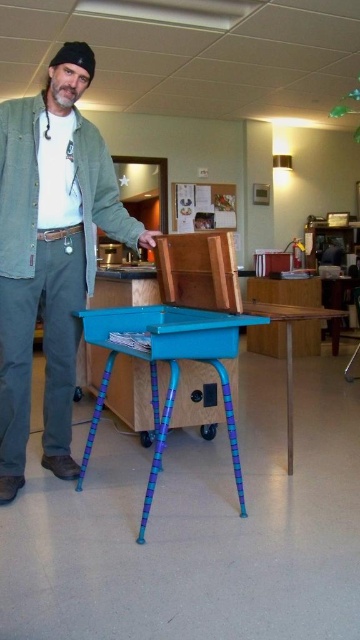
Does matte green jacket at center lie behind teal plastic table at center?

Yes, matte green jacket at center is further from the viewer.

Is point (68, 273) positioned in front of point (259, 316)?

No, (68, 273) is behind (259, 316).

The width and height of the screenshot is (360, 640). What do you see at coordinates (50, 253) in the screenshot?
I see `matte green jacket at center` at bounding box center [50, 253].

Locate an element on the screen. The width and height of the screenshot is (360, 640). matte green jacket at center is located at coordinates (50, 253).

Locate an element on the screen. The image size is (360, 640). matte green jacket at center is located at coordinates (50, 253).

Which is above, matte green jacket at center or wooden table at center?

matte green jacket at center is above.

The image size is (360, 640). Describe the element at coordinates (50, 253) in the screenshot. I see `matte green jacket at center` at that location.

Locate an element on the screen. This screenshot has width=360, height=640. matte green jacket at center is located at coordinates (50, 253).

Who is higher up, matte green jacket at center or metallic silver folding chair at right?

matte green jacket at center is above.

Does matte green jacket at center appear under metallic silver folding chair at right?

Actually, matte green jacket at center is above metallic silver folding chair at right.

At what (x,y) coordinates should I click in order to perform the action: click on matte green jacket at center. Please return your answer as a coordinate pair (x, y). The width and height of the screenshot is (360, 640). Looking at the image, I should click on (50, 253).